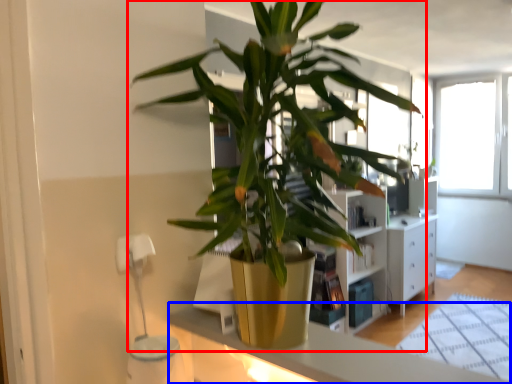
Question: Which point is further to the camera, houseplant (highlighted by a red box) or counter top (highlighted by a blue box)?

Choices:
 (A) houseplant
 (B) counter top

Answer: (B)